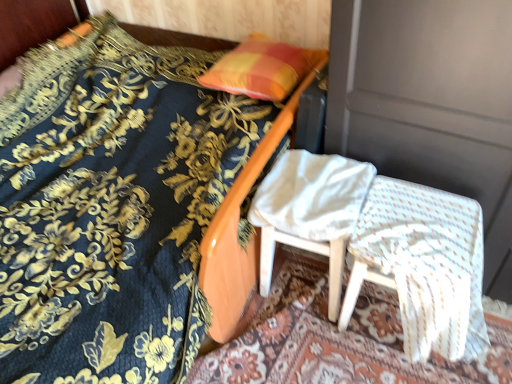
Question: Is orange/yellow fabric pillow at upper center to the left of white woven fabric chair at lower right, the 1th chair from the right, from the viewer's perspective?

Choices:
 (A) no
 (B) yes

Answer: (B)

Question: Are orange/yellow fabric pillow at upper center and white woven fabric chair at lower right, the 1th chair from the right, located far from each other?

Choices:
 (A) yes
 (B) no

Answer: (B)

Question: Does orange/yellow fabric pillow at upper center have a lesser height compared to white woven fabric chair at lower right, the 1th chair from the right?

Choices:
 (A) no
 (B) yes

Answer: (B)

Question: Considering the relative sizes of orange/yellow fabric pillow at upper center and white woven fabric chair at lower right, which is the second chair from left to right, in the image provided, is orange/yellow fabric pillow at upper center thinner than white woven fabric chair at lower right, which is the second chair from left to right,?

Choices:
 (A) no
 (B) yes

Answer: (B)

Question: Is orange/yellow fabric pillow at upper center positioned before white woven fabric chair at lower right, the 1th chair from the right?

Choices:
 (A) yes
 (B) no

Answer: (B)

Question: Considering the positions of white wood chair at center, which is counted as the first chair, starting from the left, and white woven fabric chair at lower right, which is the second chair from left to right, in the image, is white wood chair at center, which is counted as the first chair, starting from the left, bigger or smaller than white woven fabric chair at lower right, which is the second chair from left to right,?

Choices:
 (A) big
 (B) small

Answer: (B)

Question: Is white wood chair at center, which is counted as the first chair, starting from the left, in front of or behind white woven fabric chair at lower right, the 1th chair from the right, in the image?

Choices:
 (A) front
 (B) behind

Answer: (B)

Question: Looking at their shapes, would you say white wood chair at center, which is counted as the first chair, starting from the left, is wider or thinner than white woven fabric chair at lower right, which is the second chair from left to right?

Choices:
 (A) thin
 (B) wide

Answer: (A)

Question: Is white wood chair at center, which is counted as the first chair, starting from the left, inside the boundaries of white woven fabric chair at lower right, the 1th chair from the right, or outside?

Choices:
 (A) inside
 (B) outside

Answer: (B)

Question: In terms of size, does orange/yellow fabric pillow at upper center appear bigger or smaller than velvet blue bedspread at upper left?

Choices:
 (A) small
 (B) big

Answer: (A)

Question: In the image, is orange/yellow fabric pillow at upper center positioned in front of or behind velvet blue bedspread at upper left?

Choices:
 (A) behind
 (B) front

Answer: (A)

Question: From a real-world perspective, is orange/yellow fabric pillow at upper center above or below velvet blue bedspread at upper left?

Choices:
 (A) below
 (B) above

Answer: (B)

Question: Which is correct: orange/yellow fabric pillow at upper center is inside velvet blue bedspread at upper left, or outside of it?

Choices:
 (A) inside
 (B) outside

Answer: (A)

Question: Which is correct: white woven fabric chair at lower right, which is the second chair from left to right, is inside white wood chair at center, which is counted as the first chair, starting from the left, or outside of it?

Choices:
 (A) inside
 (B) outside

Answer: (B)

Question: Is white woven fabric chair at lower right, the 1th chair from the right, wider or thinner than white wood chair at center, which is counted as the first chair, starting from the left?

Choices:
 (A) thin
 (B) wide

Answer: (B)